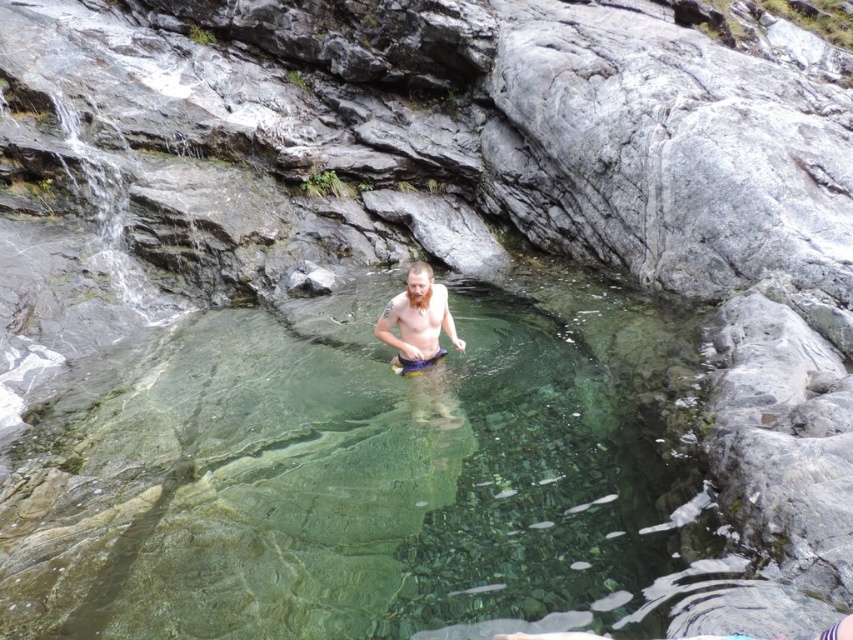
Does clear glassy water at center appear over purple fabric shorts at center?

No.

Can you confirm if clear glassy water at center is bigger than purple fabric shorts at center?

No, clear glassy water at center is not bigger than purple fabric shorts at center.

Is point (183, 502) behind point (386, 308)?

No, (183, 502) is closer to viewer.

Where is `clear glassy water at center`? clear glassy water at center is located at coordinates (326, 483).